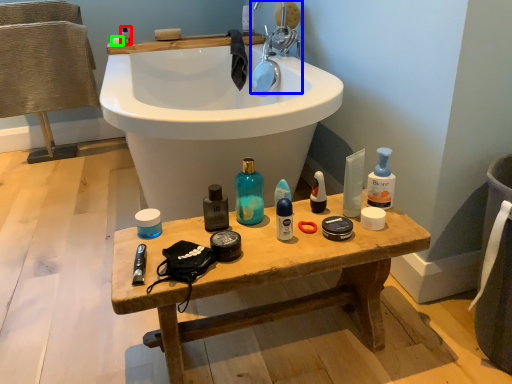
Question: Which object is positioned farthest from toiletry (highlighted by a red box)? Select from tap (highlighted by a blue box) and soap (highlighted by a green box).

Choices:
 (A) tap
 (B) soap

Answer: (A)